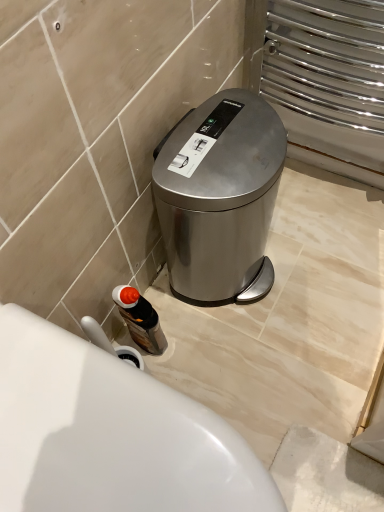
In order to click on satin metallic trash can at lower right in this screenshot , I will do `click(220, 197)`.

Identify the location of white glossy toilet at lower left. (110, 433).

Between translucent plastic bottle at lower left and white glossy toilet at lower left, which one has smaller width?

Thinner between the two is translucent plastic bottle at lower left.

From the image's perspective, which one is positioned lower, translucent plastic bottle at lower left or white glossy toilet at lower left?

white glossy toilet at lower left, from the image's perspective.

In the image, is translucent plastic bottle at lower left on the left side or the right side of white glossy toilet at lower left?

Based on their positions, translucent plastic bottle at lower left is located to the left of white glossy toilet at lower left.

Is translucent plastic bottle at lower left outside of white glossy toilet at lower left?

Absolutely, translucent plastic bottle at lower left is external to white glossy toilet at lower left.

Based on the photo, can you tell me how much satin metallic trash can at lower right and translucent plastic bottle at lower left differ in facing direction?

7.74 degrees separate the facing orientations of satin metallic trash can at lower right and translucent plastic bottle at lower left.

Where is `waste container lying above the translucent plastic bottle at lower left (from the image's perspective)`? The width and height of the screenshot is (384, 512). waste container lying above the translucent plastic bottle at lower left (from the image's perspective) is located at coordinates (220, 197).

Is satin metallic trash can at lower right in contact with translucent plastic bottle at lower left?

No, satin metallic trash can at lower right is not touching translucent plastic bottle at lower left.

Is satin metallic trash can at lower right situated inside translucent plastic bottle at lower left or outside?

satin metallic trash can at lower right exists outside the volume of translucent plastic bottle at lower left.

Can you confirm if white glossy toilet at lower left is wider than translucent plastic bottle at lower left?

Yes.

Is the surface of white glossy toilet at lower left in direct contact with translucent plastic bottle at lower left?

white glossy toilet at lower left is not next to translucent plastic bottle at lower left, and they're not touching.

From a real-world perspective, is white glossy toilet at lower left positioned under translucent plastic bottle at lower left based on gravity?

Actually, white glossy toilet at lower left is physically above translucent plastic bottle at lower left in the real world.

Who is shorter, white glossy toilet at lower left or satin metallic trash can at lower right?

Standing shorter between the two is white glossy toilet at lower left.

Does point (148, 400) appear closer or farther from the camera than point (234, 131)?

Point (148, 400) appears to be closer to the viewer than point (234, 131).

Do you think white glossy toilet at lower left is within satin metallic trash can at lower right, or outside of it?

white glossy toilet at lower left is located beyond the bounds of satin metallic trash can at lower right.

From the image's perspective, which one is positioned lower, translucent plastic bottle at lower left or satin metallic trash can at lower right?

translucent plastic bottle at lower left is shown below in the image.

Is translucent plastic bottle at lower left smaller than satin metallic trash can at lower right?

Yes, translucent plastic bottle at lower left is smaller than satin metallic trash can at lower right.

Can you confirm if translucent plastic bottle at lower left is wider than satin metallic trash can at lower right?

No.

In the scene shown: Considering the relative sizes of translucent plastic bottle at lower left and satin metallic trash can at lower right in the image provided, is translucent plastic bottle at lower left shorter than satin metallic trash can at lower right?

Indeed, translucent plastic bottle at lower left has a lesser height compared to satin metallic trash can at lower right.

Is satin metallic trash can at lower right not close to white glossy toilet at lower left?

No.

How distant is satin metallic trash can at lower right from white glossy toilet at lower left?

They are 17.40 inches apart.

From the image's perspective, which is above, satin metallic trash can at lower right or white glossy toilet at lower left?

satin metallic trash can at lower right, from the image's perspective.

Considering the sizes of objects satin metallic trash can at lower right and white glossy toilet at lower left in the image provided, who is bigger, satin metallic trash can at lower right or white glossy toilet at lower left?

white glossy toilet at lower left.

Identify the location of toilet positioned vertically above the translucent plastic bottle at lower left (from a real-world perspective). The width and height of the screenshot is (384, 512). (110, 433).

Identify the location of bottle on the left of satin metallic trash can at lower right. (140, 319).

When comparing their distances from white glossy toilet at lower left, does satin metallic trash can at lower right or translucent plastic bottle at lower left seem closer?

translucent plastic bottle at lower left.

Based on their spatial positions, is white glossy toilet at lower left or translucent plastic bottle at lower left further from satin metallic trash can at lower right?

Among the two, white glossy toilet at lower left is located further to satin metallic trash can at lower right.

Considering their positions, is satin metallic trash can at lower right positioned closer to translucent plastic bottle at lower left than white glossy toilet at lower left?

Based on the image, satin metallic trash can at lower right appears to be nearer to translucent plastic bottle at lower left.

Based on the photo, looking at the image, which one is located closer to white glossy toilet at lower left, translucent plastic bottle at lower left or satin metallic trash can at lower right?

translucent plastic bottle at lower left is positioned closer to the anchor white glossy toilet at lower left.

Estimate the real-world distances between objects in this image. Which object is closer to translucent plastic bottle at lower left, white glossy toilet at lower left or satin metallic trash can at lower right?

Based on the image, satin metallic trash can at lower right appears to be nearer to translucent plastic bottle at lower left.

Based on their spatial positions, is translucent plastic bottle at lower left or white glossy toilet at lower left further from satin metallic trash can at lower right?

white glossy toilet at lower left lies further to satin metallic trash can at lower right than the other object.

Find the location of a particular element. Image resolution: width=384 pixels, height=512 pixels. waste container between white glossy toilet at lower left and translucent plastic bottle at lower left in the front-back direction is located at coordinates (220, 197).